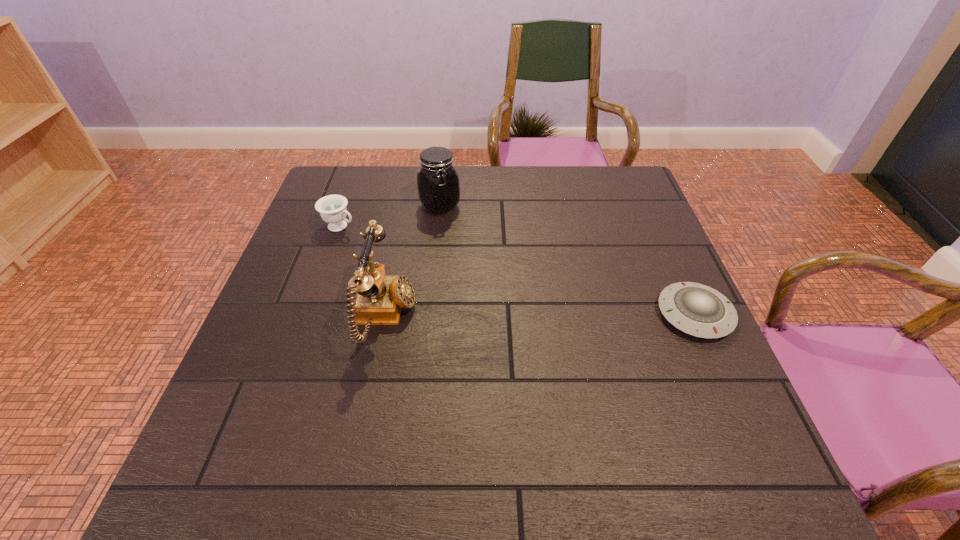
Where is `free space at the right edge of the desktop`? The height and width of the screenshot is (540, 960). free space at the right edge of the desktop is located at coordinates 664,276.

The width and height of the screenshot is (960, 540). Find the location of `vacant space at the far left corner`. vacant space at the far left corner is located at coordinates (355, 172).

Locate an element on the screen. This screenshot has height=540, width=960. vacant space at the near left corner is located at coordinates (257, 414).

I want to click on free space at the far right corner of the desktop, so click(x=595, y=194).

You are a GUI agent. You are given a task and a screenshot of the screen. Output one action in this format:
    pyautogui.click(x=<x>, y=<y>)
    Task: Click on the vacant area between the jar and the rightmost object
    
    Given the screenshot: What is the action you would take?
    pyautogui.click(x=567, y=260)

Where is `free spot between the third tallest object and the jar`? free spot between the third tallest object and the jar is located at coordinates (390, 216).

You are a GUI agent. You are given a task and a screenshot of the screen. Output one action in this format:
    pyautogui.click(x=<x>, y=<y>)
    Task: Click on the free space between the jar and the teacup
    Image resolution: width=960 pixels, height=540 pixels.
    Given the screenshot: What is the action you would take?
    pyautogui.click(x=390, y=216)

Find the location of a particular element. The image size is (960, 540). vacant point located between the third tallest object and the jar is located at coordinates (390, 216).

You are a GUI agent. You are given a task and a screenshot of the screen. Output one action in this format:
    pyautogui.click(x=<x>, y=<y>)
    Task: Click on the free space between the shortest object and the jar
    
    Given the screenshot: What is the action you would take?
    pyautogui.click(x=567, y=260)

Locate an element on the screen. The image size is (960, 540). empty location between the shortest object and the jar is located at coordinates pyautogui.click(x=567, y=260).